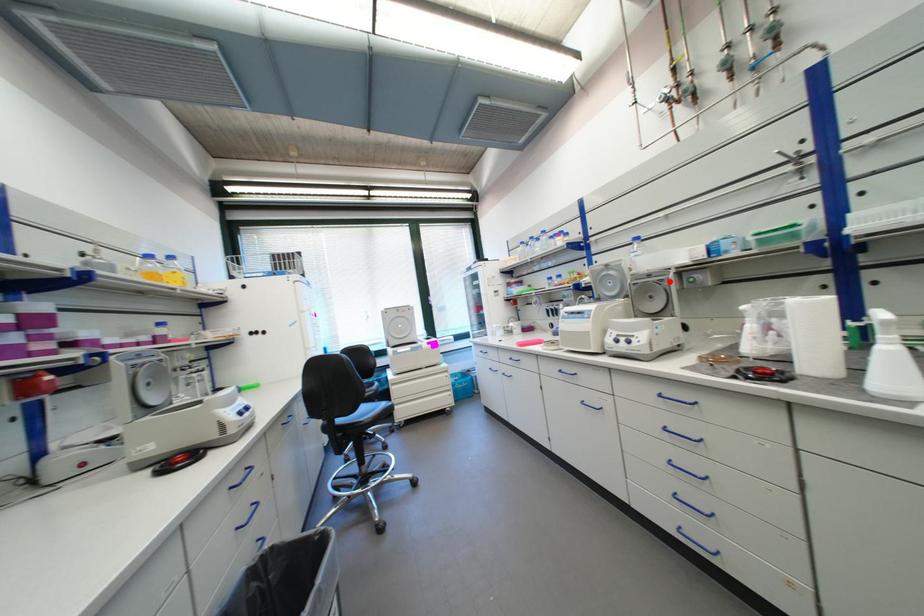
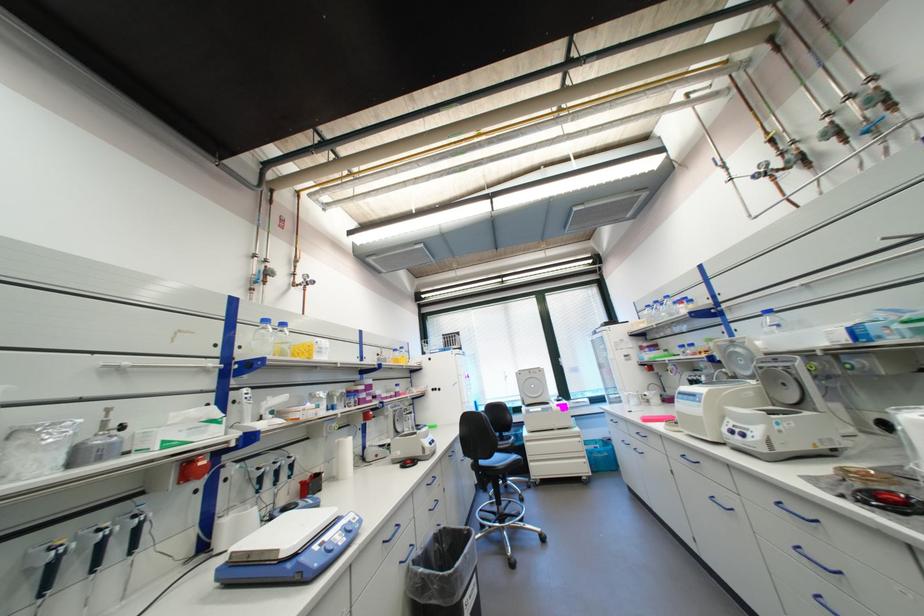
Where in the second image is the point corresponding to the highlighted location from the first image?

(796, 369)